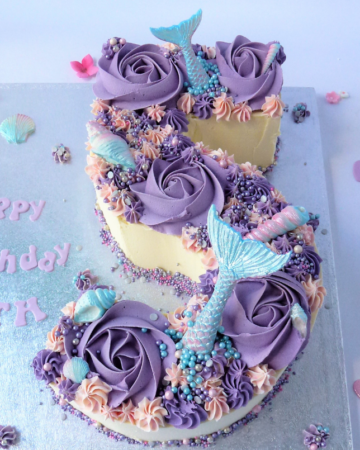
Identify the location of floor. point(90,256).